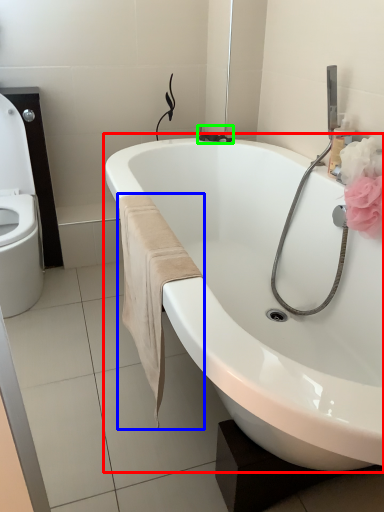
Question: Based on their relative distances, which object is farther from bathtub (highlighted by a red box)? Choose from bath towel (highlighted by a blue box) and plumbing fixture (highlighted by a green box).

Choices:
 (A) bath towel
 (B) plumbing fixture

Answer: (B)